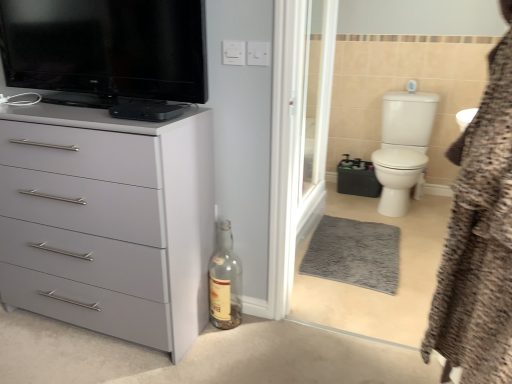
Question: Is transparent glass screen door at center inside or outside of brown textured bathrobe at right?

Choices:
 (A) inside
 (B) outside

Answer: (B)

Question: From a real-world perspective, relative to brown textured bathrobe at right, is transparent glass screen door at center vertically above or below?

Choices:
 (A) above
 (B) below

Answer: (B)

Question: Considering the real-world distances, which object is closest to the white glossy toilet bowl at right?

Choices:
 (A) transparent glass screen door at center
 (B) brown textured bathrobe at right
 (C) matte gray chest of drawers at left
 (D) black glossy television at upper left
 (E) clear glass bottle at lower center

Answer: (A)

Question: Estimate the real-world distances between objects in this image. Which object is farther from the matte gray chest of drawers at left?

Choices:
 (A) white glossy toilet bowl at right
 (B) black glossy television at upper left
 (C) transparent glass screen door at center
 (D) brown textured bathrobe at right
 (E) clear glass bottle at lower center

Answer: (A)